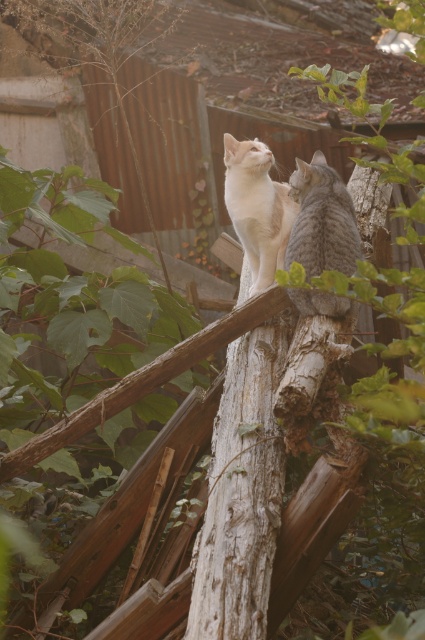
Looking at this image, is gray striped cat at upper right taller than white fur cat at center?

Correct, gray striped cat at upper right is much taller as white fur cat at center.

This screenshot has width=425, height=640. What do you see at coordinates (322, 220) in the screenshot?
I see `gray striped cat at upper right` at bounding box center [322, 220].

Find the location of `gray striped cat at upper right`. gray striped cat at upper right is located at coordinates (322, 220).

The image size is (425, 640). What do you see at coordinates (241, 492) in the screenshot?
I see `gray rough wood at center` at bounding box center [241, 492].

Who is more distant from viewer, (271, 296) or (331, 310)?

The point (271, 296) is behind.

At what (x,y) coordinates should I click in order to perform the action: click on gray rough wood at center. Please return your answer as a coordinate pair (x, y). This screenshot has width=425, height=640. Looking at the image, I should click on (241, 492).

Does gray rough wood at center have a greater width compared to white fur cat at center?

Correct, the width of gray rough wood at center exceeds that of white fur cat at center.

Can you confirm if gray rough wood at center is positioned to the left of white fur cat at center?

Indeed, gray rough wood at center is positioned on the left side of white fur cat at center.

Is point (277, 371) closer to camera compared to point (255, 140)?

Yes.

Locate an element on the screen. gray rough wood at center is located at coordinates (241, 492).